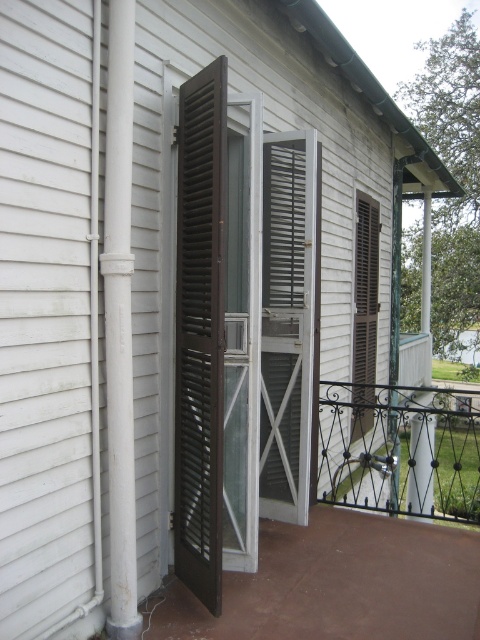
Question: Is brown wooden screen door at left bigger than white painted metal pipe at left?

Choices:
 (A) no
 (B) yes

Answer: (B)

Question: Which is farther from the white painted metal pipe at left?

Choices:
 (A) brown wooden screen door at left
 (B) brown wooden shutter at center

Answer: (B)

Question: Among these objects, which one is nearest to the camera?

Choices:
 (A) brown wooden shutter at center
 (B) white painted metal pipe at left

Answer: (B)

Question: Can you confirm if white painted metal pipe at left is positioned to the left of brown wooden shutter at center?

Choices:
 (A) yes
 (B) no

Answer: (A)

Question: Estimate the real-world distances between objects in this image. Which object is farther from the brown wooden shutter at center?

Choices:
 (A) brown wooden screen door at left
 (B) white painted metal pipe at left

Answer: (B)

Question: Does white painted metal pipe at left have a lesser width compared to brown wooden shutter at center?

Choices:
 (A) no
 (B) yes

Answer: (B)